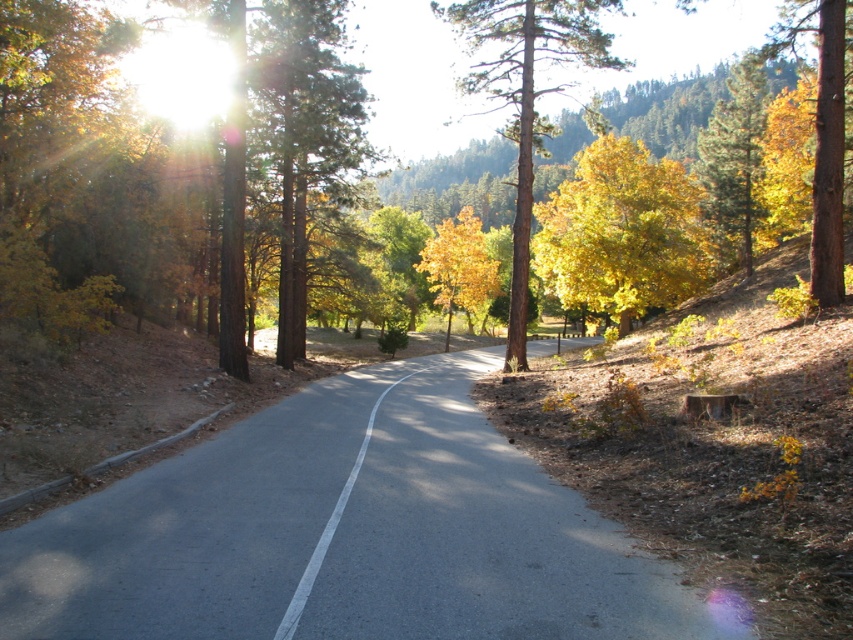
Question: Which object is the farthest from the golden yellow leaves at upper right?

Choices:
 (A) brown textured tree at center
 (B) yellow/golden leaves at center
 (C) yellow/golden leaves at upper right
 (D) golden yellow leaves at center

Answer: (D)

Question: Is asphalt road at center positioned before yellow/golden leaves at center?

Choices:
 (A) yes
 (B) no

Answer: (A)

Question: Which of these objects is positioned farthest from the golden yellow leaves at upper right?

Choices:
 (A) yellow/golden leaves at upper right
 (B) asphalt road at center
 (C) yellow/golden leaves at center

Answer: (B)

Question: Can you confirm if brown textured tree at center is positioned below yellow/golden leaves at upper right?

Choices:
 (A) yes
 (B) no

Answer: (B)

Question: Is brown textured tree at center positioned before golden yellow leaves at upper right?

Choices:
 (A) no
 (B) yes

Answer: (B)

Question: Which point is closer to the camera?

Choices:
 (A) (567, 45)
 (B) (744, 161)

Answer: (A)